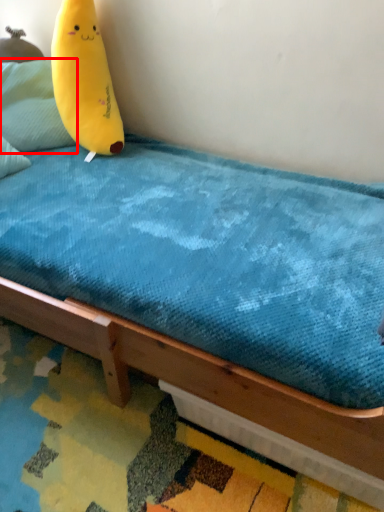
Question: From the image's perspective, what is the correct spatial relationship of pillow (annotated by the red box) in relation to banana?

Choices:
 (A) above
 (B) below

Answer: (A)